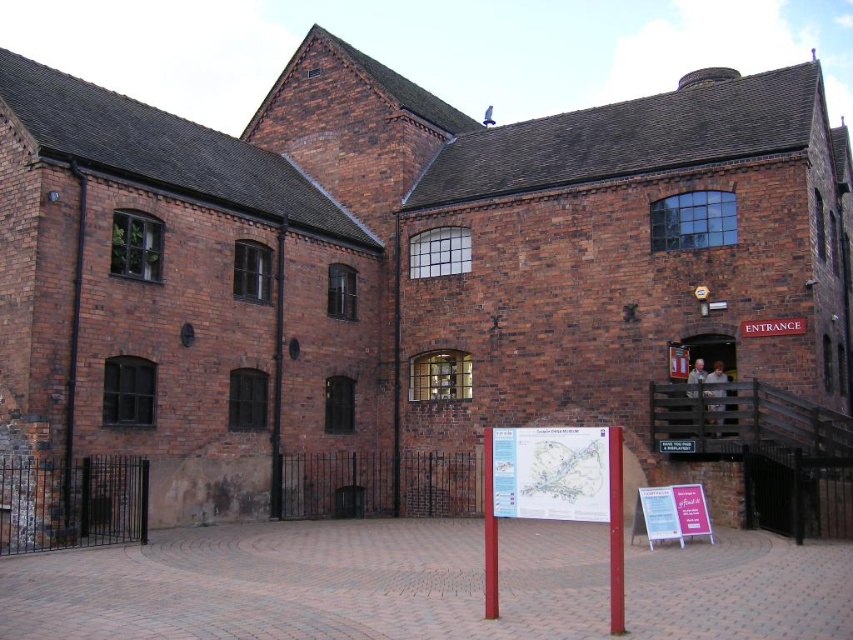
Question: Which object is positioned farthest from the red brick sign at center?

Choices:
 (A) smooth red pole at center
 (B) light blue paper map at center
 (C) smooth wooden pole at center
 (D) wooden gate at center

Answer: (C)

Question: Is light blue paper map at center smaller than wooden gate at center?

Choices:
 (A) yes
 (B) no

Answer: (B)

Question: Considering the real-world distances, which object is farthest from the wooden gate at center?

Choices:
 (A) light blue paper map at center
 (B) smooth red pole at center

Answer: (A)

Question: Does pink paper sign at center have a greater width compared to wooden gate at center?

Choices:
 (A) yes
 (B) no

Answer: (B)

Question: Does light blue paper map at center appear over smooth wooden pole at center?

Choices:
 (A) no
 (B) yes

Answer: (B)

Question: Which object is the closest to the pink paper sign at center?

Choices:
 (A) smooth wooden pole at center
 (B) smooth red pole at center

Answer: (B)